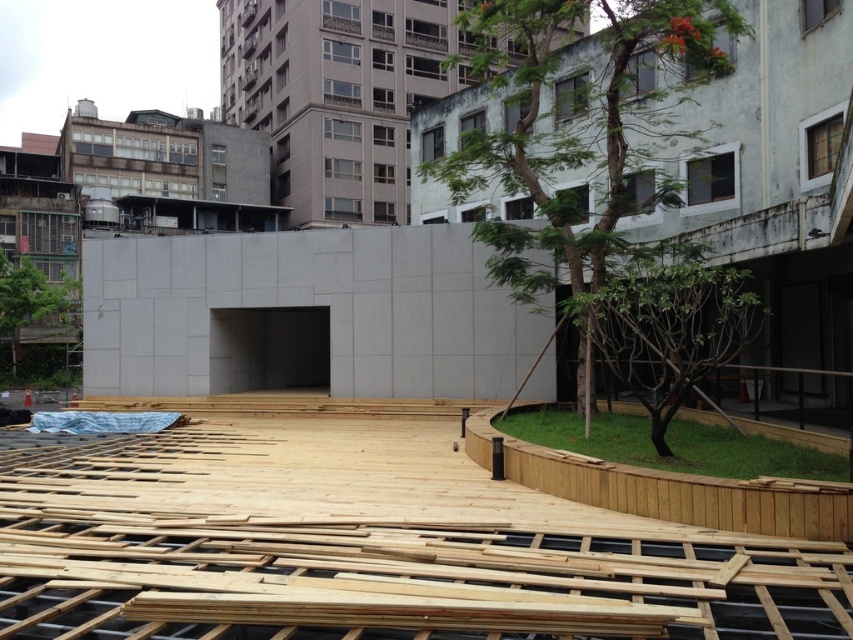
Question: Can you confirm if green leafy tree at center is smaller than green leafy tree at center-right?

Choices:
 (A) yes
 (B) no

Answer: (B)

Question: Is natural wood planks at center positioned before green leafy tree at center?

Choices:
 (A) yes
 (B) no

Answer: (A)

Question: Which point is closer to the camera?

Choices:
 (A) green leafy tree at center
 (B) natural wood planks at center

Answer: (B)

Question: Considering the real-world distances, which object is farthest from the green leafy tree at center-right?

Choices:
 (A) natural wood planks at center
 (B) green leafy tree at center

Answer: (B)

Question: Which object is farther from the camera taking this photo?

Choices:
 (A) green leafy tree at center
 (B) natural wood planks at center
 (C) green leafy tree at center-right

Answer: (C)

Question: From the image, what is the correct spatial relationship of natural wood planks at center in relation to green leafy tree at center-right?

Choices:
 (A) left
 (B) right

Answer: (A)